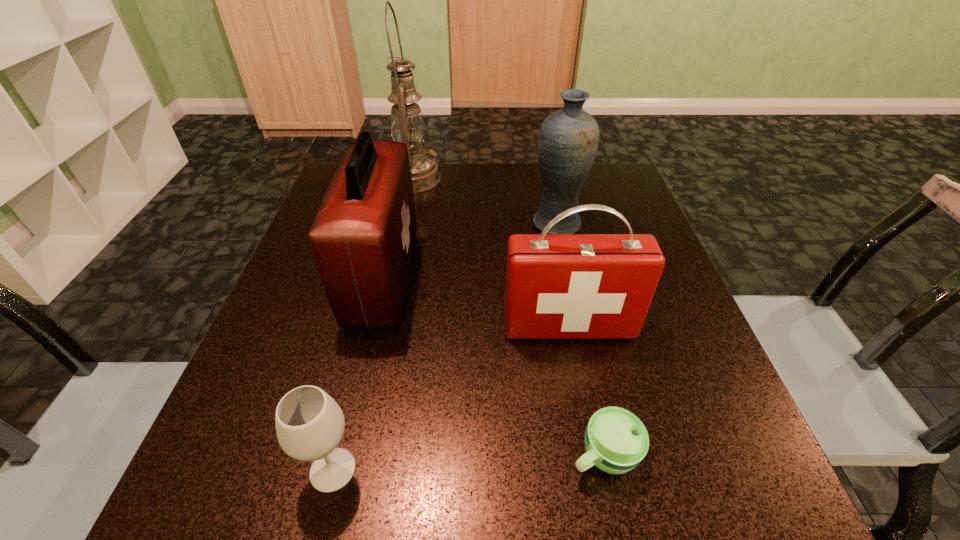
Locate an element on the screen. The width and height of the screenshot is (960, 540). the farthest object is located at coordinates (407, 126).

The image size is (960, 540). Identify the location of the tallest object. (407, 126).

I want to click on vase, so click(x=568, y=139).

Locate an element on the screen. the left first-aid kit is located at coordinates (363, 236).

In order to click on the right first-aid kit in this screenshot , I will do `click(558, 286)`.

You are a GUI agent. You are given a task and a screenshot of the screen. Output one action in this format:
    pyautogui.click(x=<x>, y=<y>)
    Task: Click on the fifth tallest object
    
    Given the screenshot: What is the action you would take?
    pyautogui.click(x=309, y=423)

Find the location of a particular element. This screenshot has height=540, width=960. the shortest object is located at coordinates (616, 441).

Where is `blank area located 0.100m on the left of the farthest object`? The width and height of the screenshot is (960, 540). blank area located 0.100m on the left of the farthest object is located at coordinates (348, 178).

The height and width of the screenshot is (540, 960). What are the coordinates of `free space located on the left of the vase` in the screenshot? It's located at (483, 225).

The height and width of the screenshot is (540, 960). What are the coordinates of `vacant region located on the side of the left first-aid kit with the cross symbol` in the screenshot? It's located at (597, 277).